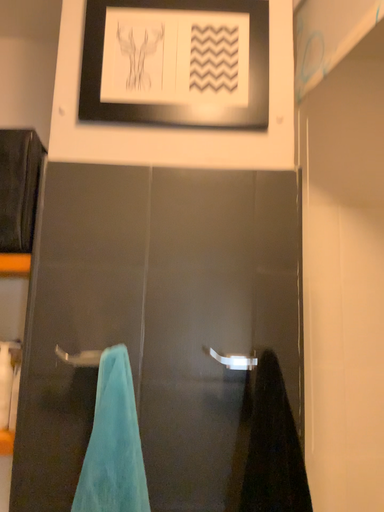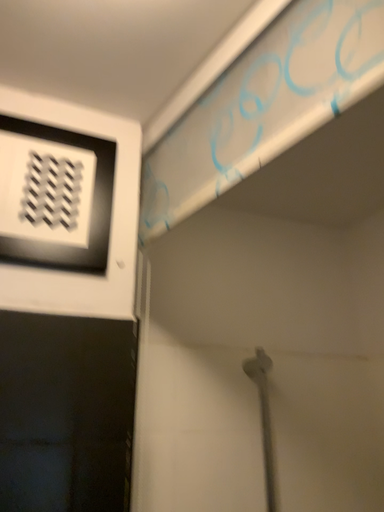
Question: How did the camera likely rotate when shooting the video?

Choices:
 (A) rotated right
 (B) rotated left

Answer: (A)